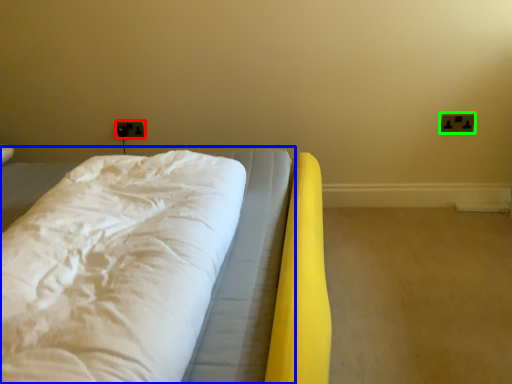
Question: Which object is the farthest from electric outlet (highlighted by a red box)? Choose among these: bed (highlighted by a blue box) or electric outlet (highlighted by a green box).

Choices:
 (A) bed
 (B) electric outlet

Answer: (B)